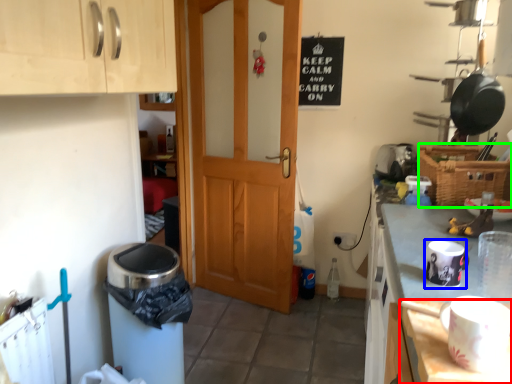
Question: Which object is the farthest from table (highlighted by a red box)? Choose among these: appliance (highlighted by a blue box) or basket (highlighted by a green box).

Choices:
 (A) appliance
 (B) basket

Answer: (B)